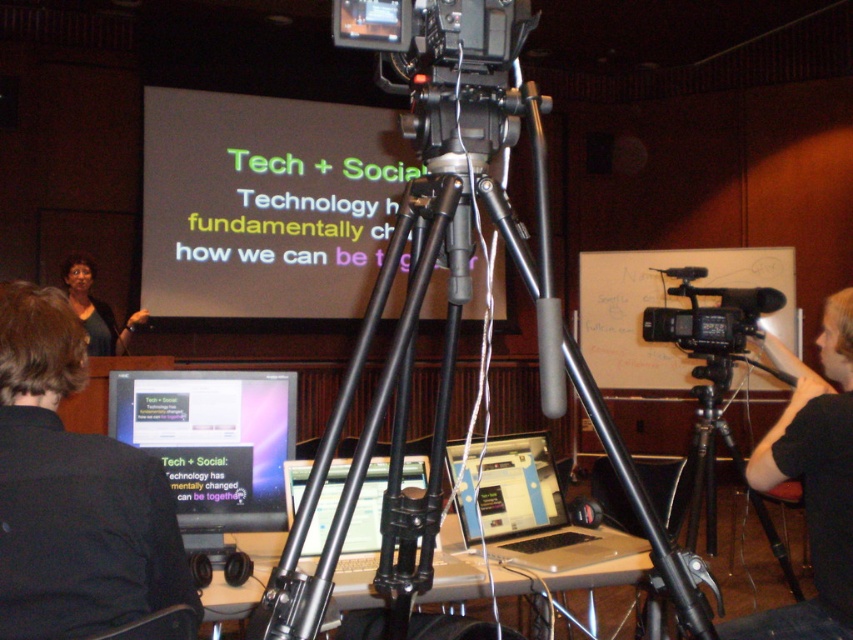
Is matte black screen at center wider than matte black shirt at left?

Incorrect, matte black screen at center's width does not surpass matte black shirt at left's.

Does matte black screen at center appear on the right side of matte black shirt at left?

Yes, matte black screen at center is to the right of matte black shirt at left.

Which is in front, point (306, 472) or point (135, 321)?

Point (306, 472)

At what (x,y) coordinates should I click in order to perform the action: click on matte black screen at center. Please return your answer as a coordinate pair (x, y). The height and width of the screenshot is (640, 853). Looking at the image, I should click on (367, 509).

Is point (718, 634) in front of point (469, 472)?

Yes, point (718, 634) is in front of point (469, 472).

Looking at this image, does black fabric shirt at center right have a smaller size compared to beige plastic laptop at center?

Incorrect, black fabric shirt at center right is not smaller in size than beige plastic laptop at center.

Measure the distance between black fabric shirt at center right and camera.

The distance of black fabric shirt at center right from camera is 1.99 meters.

Image resolution: width=853 pixels, height=640 pixels. In order to click on black fabric shirt at center right in this screenshot , I will do `click(811, 481)`.

Between matte black projector screen at center and dark blue shirt at left, which one appears on the right side from the viewer's perspective?

Positioned to the right is dark blue shirt at left.

Can you confirm if matte black projector screen at center is positioned to the right of dark blue shirt at left?

In fact, matte black projector screen at center is to the left of dark blue shirt at left.

Locate an element on the screen. This screenshot has height=640, width=853. matte black projector screen at center is located at coordinates (265, 204).

This screenshot has height=640, width=853. I want to click on matte black projector screen at center, so click(265, 204).